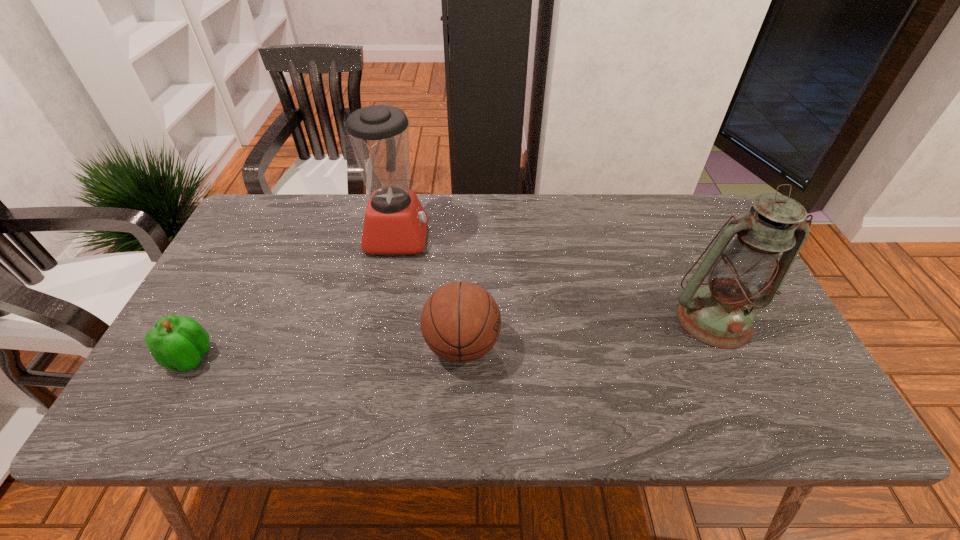
The image size is (960, 540). In order to click on vacant area situated on the back of the bell pepper in this screenshot , I will do `click(218, 307)`.

You are a GUI agent. You are given a task and a screenshot of the screen. Output one action in this format:
    pyautogui.click(x=<x>, y=<y>)
    Task: Click on the object positioned at the far edge
    
    Given the screenshot: What is the action you would take?
    pyautogui.click(x=395, y=222)

This screenshot has width=960, height=540. I want to click on object located at the left edge, so click(176, 342).

The image size is (960, 540). Identify the location of object positioned at the right edge. (741, 277).

The image size is (960, 540). In order to click on blank space at the far edge of the desktop in this screenshot , I will do [579, 216].

This screenshot has height=540, width=960. In order to click on free region at the near edge of the desktop in this screenshot , I will do `click(576, 397)`.

Identify the location of vacant area at the left edge. (233, 335).

This screenshot has width=960, height=540. I want to click on free location at the right edge, so click(x=728, y=349).

The image size is (960, 540). Identify the location of blank space at the far left corner of the desktop. (276, 200).

In the image, there is a desktop. Identify the location of vacant space at the near left corner. (173, 423).